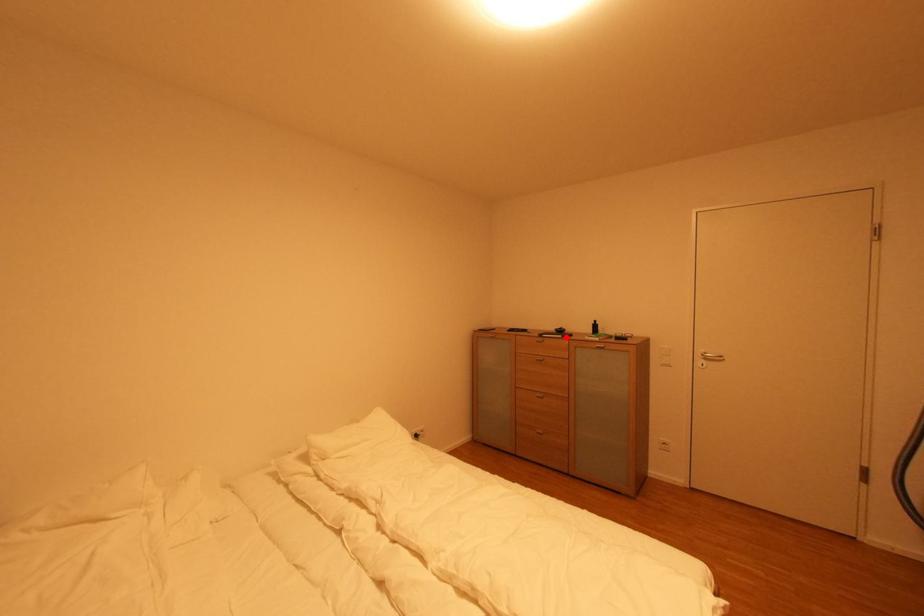
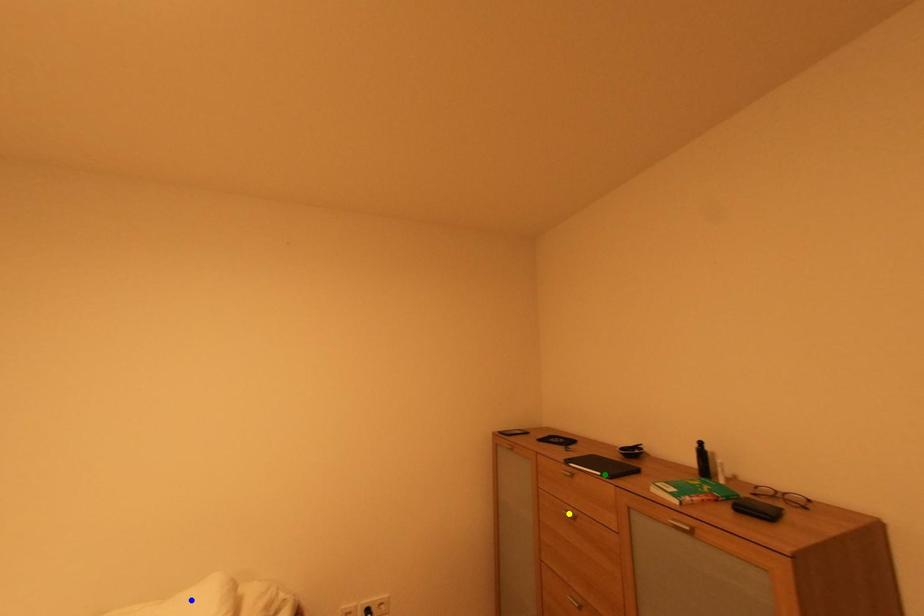
Question: I am providing you with two images of the same scene from different viewpoints. A red point is marked on the first image. You are given multiple points on the second image. Which point in image 2 is actually the same real-world point as the red point in image 1?

Choices:
 (A) blue point
 (B) green point
 (C) yellow point

Answer: (B)